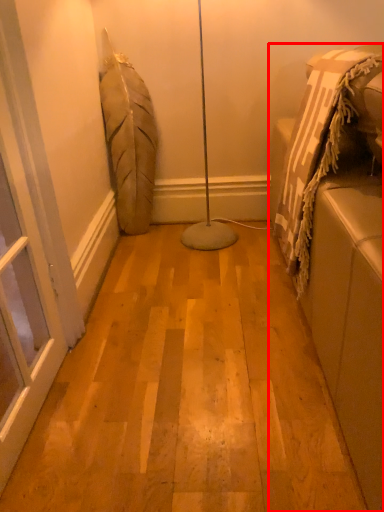
Question: Observing the image, what is the correct spatial positioning of furniture (annotated by the red box) in reference to screen door?

Choices:
 (A) left
 (B) right

Answer: (B)